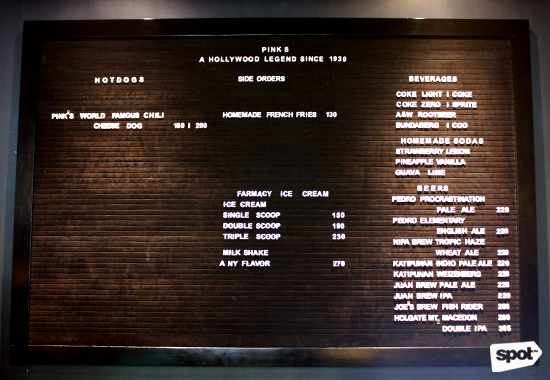
Image resolution: width=550 pixels, height=380 pixels. I want to click on black frame, so click(x=294, y=26).